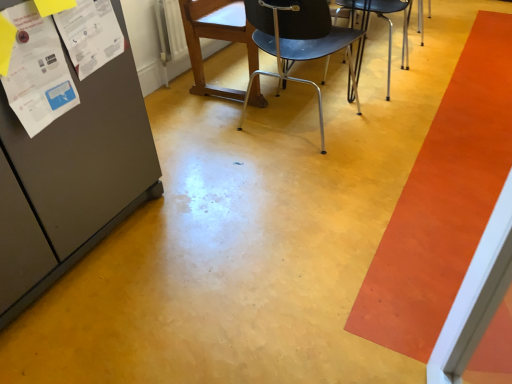
Question: From a real-world perspective, is white paper at upper left, which is the 2th poster from left to right, above or below metallic silver chair at center, acting as the 2th chair starting from the right?

Choices:
 (A) below
 (B) above

Answer: (B)

Question: Would you say white paper at upper left, which is the 2th poster from left to right, is to the left or to the right of metallic silver chair at center, acting as the 2th chair starting from the right, in the picture?

Choices:
 (A) right
 (B) left

Answer: (B)

Question: Based on their relative distances, which object is farther from the orange smooth carpet at right?

Choices:
 (A) white paper at upper left, which is the 2th poster from left to right
 (B) metallic black chair at center, positioned as the third chair in left-to-right order
 (C) white paper poster at left, the 2th poster viewed from the right
 (D) wooden chair at center, marked as the third chair in a right-to-left arrangement
 (E) metallic silver chair at center, acting as the 2th chair starting from the right

Answer: (A)

Question: Which of these objects is positioned closest to the orange smooth carpet at right?

Choices:
 (A) white paper at upper left, positioned as the first poster in right-to-left order
 (B) metallic silver chair at center, the 2th chair when ordered from left to right
 (C) wooden chair at center, marked as the third chair in a right-to-left arrangement
 (D) white paper poster at left, the 2th poster viewed from the right
 (E) metallic black chair at center, positioned as the third chair in left-to-right order

Answer: (B)